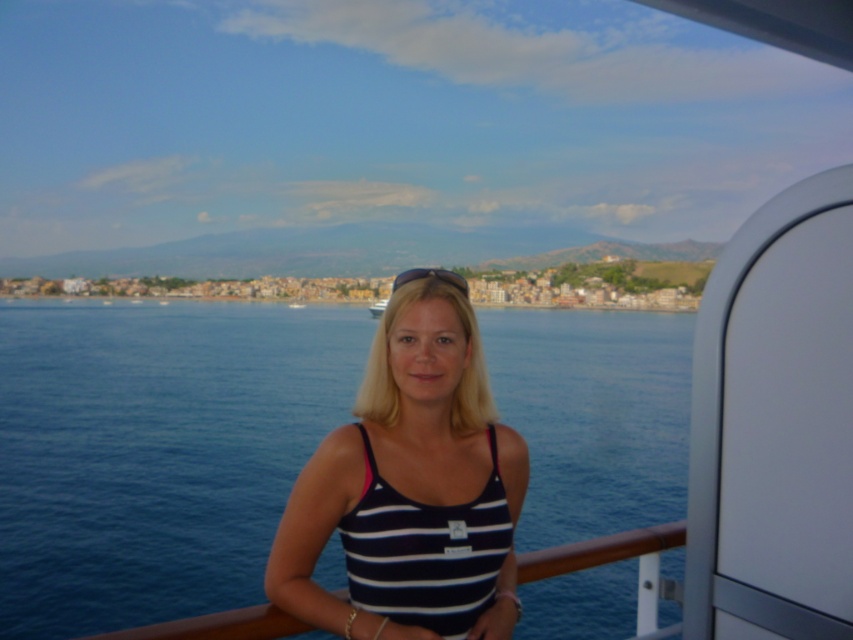
Can you confirm if blue liquid water at center is wider than white striped tank top at center?

Yes.

Which is behind, point (10, 620) or point (322, 596)?

The point (10, 620) is behind.

The image size is (853, 640). What are the coordinates of `blue liquid water at center` in the screenshot? It's located at (155, 451).

Identify the location of blue liquid water at center. (155, 451).